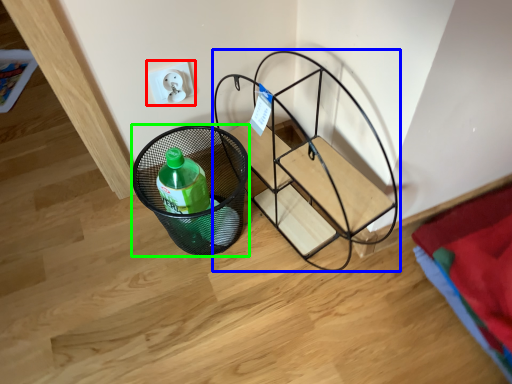
Question: Which object is positioned closest to electric outlet (highlighted by a red box)? Select from furniture (highlighted by a blue box) and basket (highlighted by a green box).

Choices:
 (A) furniture
 (B) basket

Answer: (B)